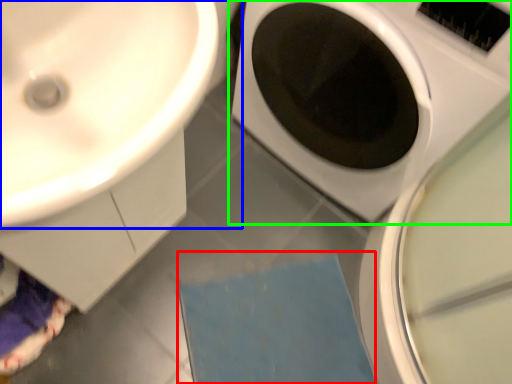
Question: Which is farther away from bath mat (highlighted by a red box)? sink (highlighted by a blue box) or washing machine (highlighted by a green box)?

Choices:
 (A) sink
 (B) washing machine

Answer: (A)